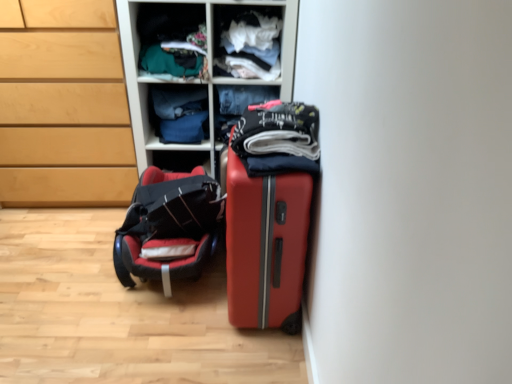
Where is `vacant region in front of matte red suitcase at center`? The width and height of the screenshot is (512, 384). vacant region in front of matte red suitcase at center is located at coordinates (233, 356).